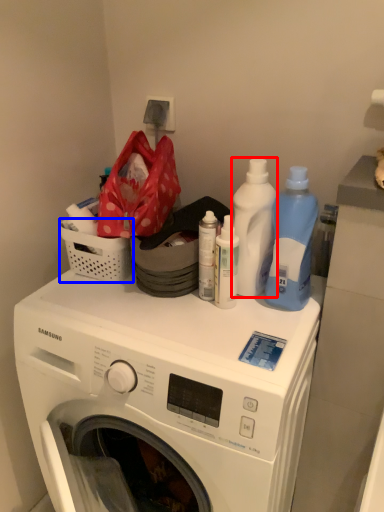
Question: Which object appears farthest to the camera in this image, cleaning product (highlighted by a red box) or basket (highlighted by a blue box)?

Choices:
 (A) cleaning product
 (B) basket

Answer: (B)